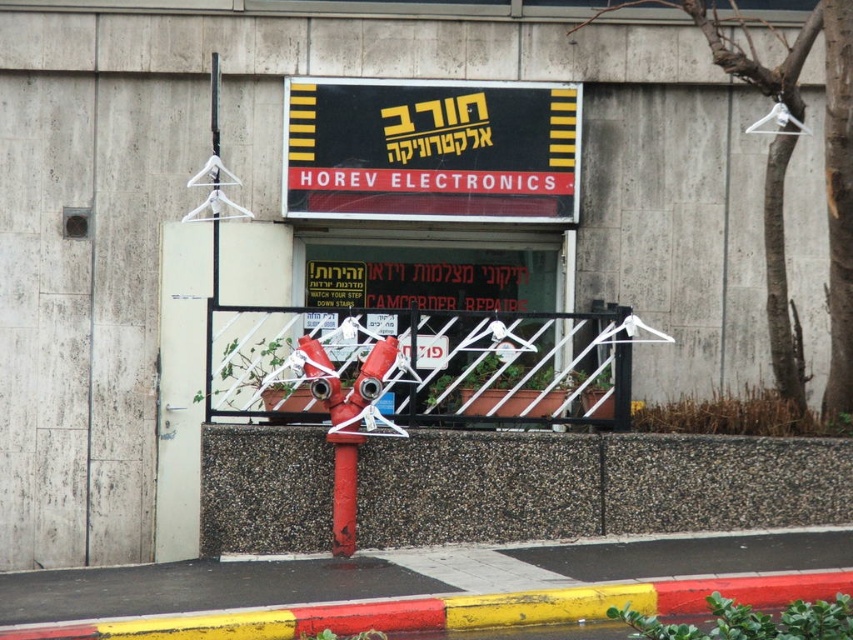
Who is taller, red concrete barrier at lower center or black plastic sign at center?

black plastic sign at center

The height and width of the screenshot is (640, 853). Identify the location of red concrete barrier at lower center. (592, 484).

Locate an element on the screen. This screenshot has width=853, height=640. red concrete barrier at lower center is located at coordinates (592, 484).

Where is `red concrete barrier at lower center`? The image size is (853, 640). red concrete barrier at lower center is located at coordinates (592, 484).

The height and width of the screenshot is (640, 853). What do you see at coordinates (592, 484) in the screenshot?
I see `red concrete barrier at lower center` at bounding box center [592, 484].

Who is higher up, red concrete barrier at lower center or red matte fire hydrant at center?

red matte fire hydrant at center is above.

Locate an element on the screen. The height and width of the screenshot is (640, 853). red concrete barrier at lower center is located at coordinates (592, 484).

The width and height of the screenshot is (853, 640). Find the location of `red concrete barrier at lower center`. red concrete barrier at lower center is located at coordinates (592, 484).

Does yellow rubber curb at lower center come behind red matte fire hydrant at center?

No, yellow rubber curb at lower center is in front of red matte fire hydrant at center.

Does yellow rubber curb at lower center have a smaller size compared to red matte fire hydrant at center?

No, yellow rubber curb at lower center is not smaller than red matte fire hydrant at center.

Who is more distant from viewer, (743, 580) or (357, 433)?

Positioned behind is point (357, 433).

You are a GUI agent. You are given a task and a screenshot of the screen. Output one action in this format:
    pyautogui.click(x=<x>, y=<y>)
    Task: Click on the yellow rubber curb at lower center
    This screenshot has width=853, height=640.
    Given the screenshot: What is the action you would take?
    pyautogui.click(x=457, y=609)